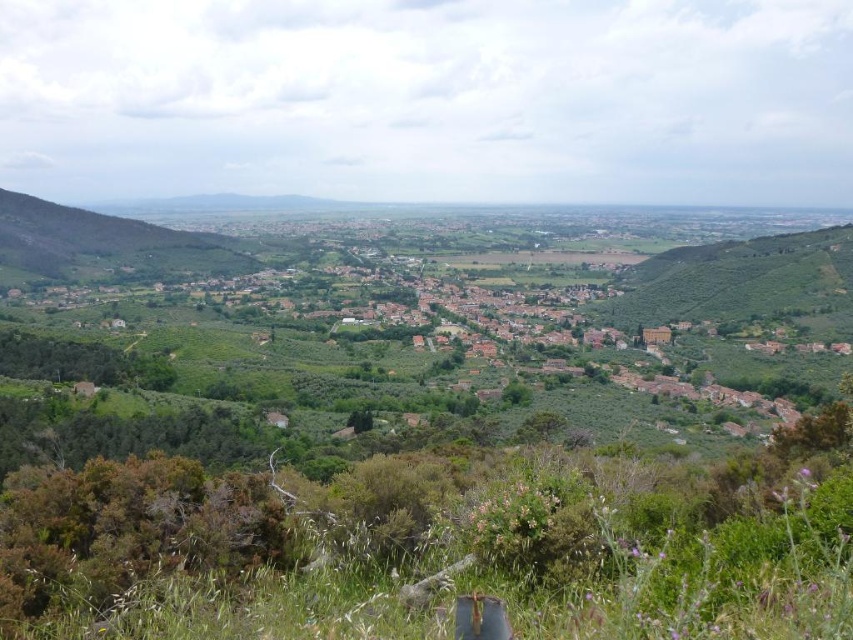
You are a hiker standing at the point closer to the viewer in the valley. You want to reach the distant hills on the horizon. Which of the two points, point (x=306, y=532) or point (x=25, y=220), should you head towards to get closer to the distant hills?

Point (x=25, y=220) is further away from the viewer than point (x=306, y=532), so heading towards point (x=25, y=220) would bring you closer to the distant hills.

You are standing in the valley and see the point marked at coordinates (416, 556). What is located at that point?

The point at coordinates (416, 556) indicates green leafy grass at lower center.

You are a hiker planning to cross the valley. You need to step over the green leafy grass at lower center and the green leafy hillside at left. Which area requires a higher step?

The green leafy hillside at left requires a higher step because it is taller than the green leafy grass at lower center.